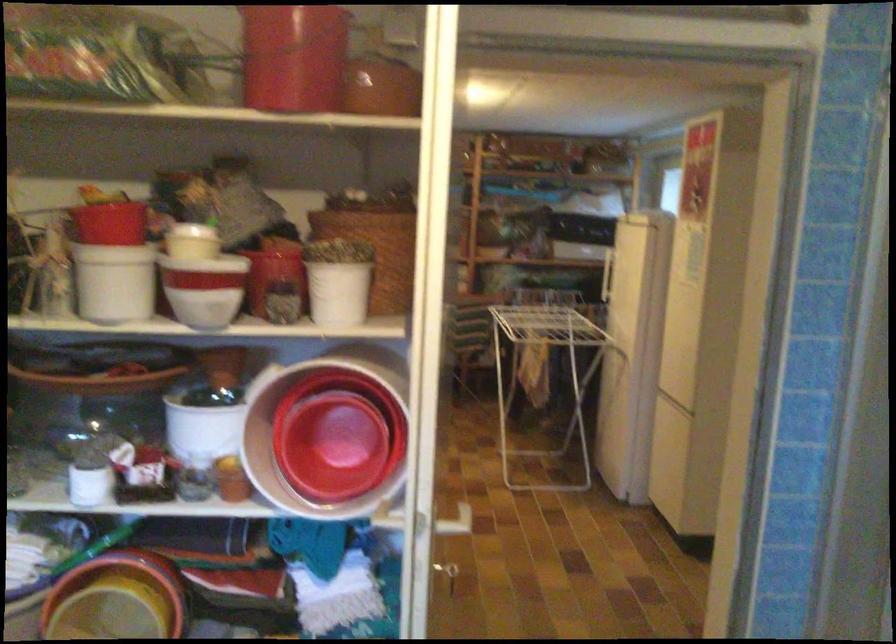
The width and height of the screenshot is (896, 644). What are the coordinates of `white drying rack` in the screenshot? It's located at (545, 375).